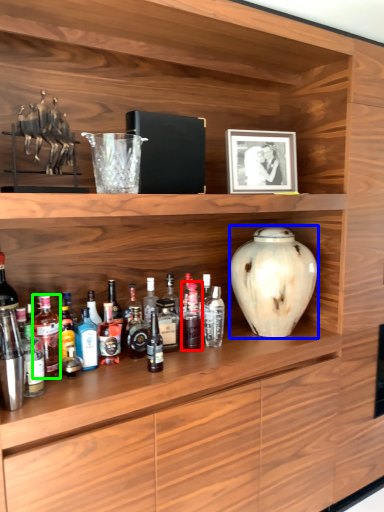
Question: Which object is the farthest from bottle (highlighted by a red box)? Choose among these: vase (highlighted by a blue box) or bottle (highlighted by a green box).

Choices:
 (A) vase
 (B) bottle

Answer: (B)